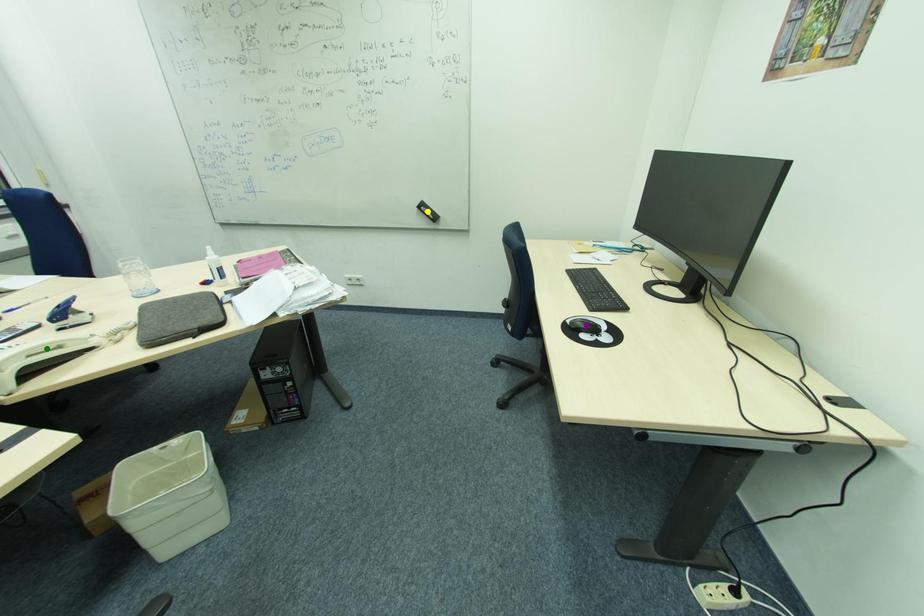
Order these from nearest to farthest:
1. green point
2. purple point
3. yellow point

yellow point → purple point → green point